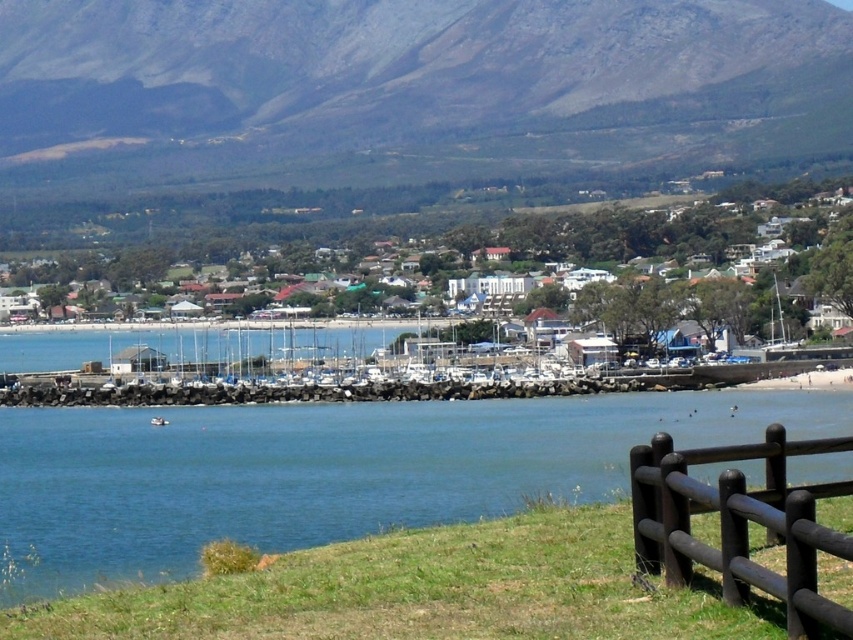
Question: Which object appears farthest from the camera in this image?

Choices:
 (A) brown wooden fence at lower right
 (B) gray rocky mountain at upper center
 (C) white plastic boat at lower center
 (D) blue water at center

Answer: (B)

Question: Does blue water at center have a larger size compared to brown wooden fence at lower right?

Choices:
 (A) yes
 (B) no

Answer: (A)

Question: Which point is farther to the camera?

Choices:
 (A) (747, 58)
 (B) (73, 493)
 (C) (160, 417)

Answer: (A)

Question: Can you confirm if gray rocky mountain at upper center is positioned above brown wooden fence at lower right?

Choices:
 (A) no
 (B) yes

Answer: (B)

Question: Which object is the farthest from the white plastic boat at lower center?

Choices:
 (A) gray rocky mountain at upper center
 (B) blue water at center

Answer: (A)

Question: In this image, where is blue water at center located relative to white plastic boat at lower center?

Choices:
 (A) below
 (B) above

Answer: (B)